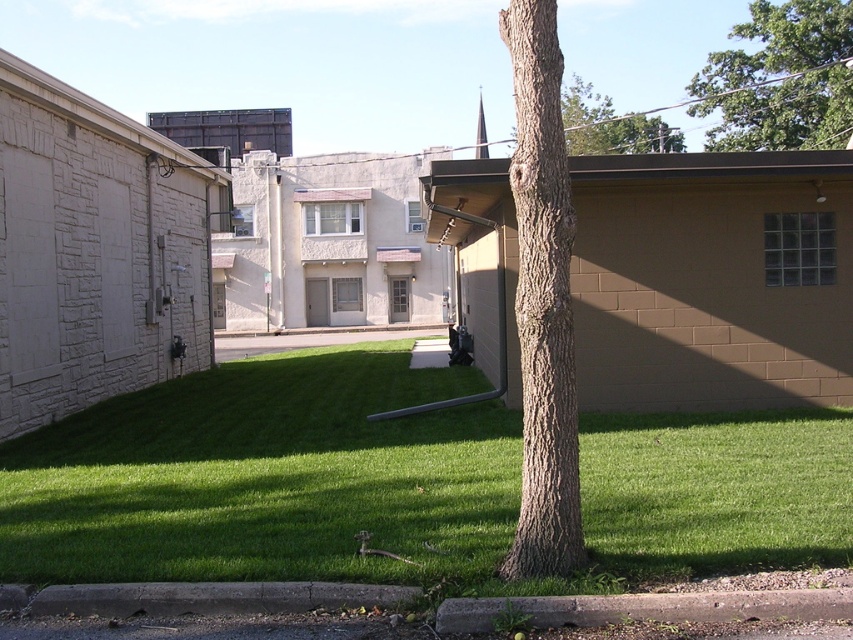
Does green grass at center appear on the right side of brown rough bark tree trunk at center?

No, green grass at center is not to the right of brown rough bark tree trunk at center.

Is point (175, 524) farther from camera compared to point (546, 132)?

Yes, it is behind point (546, 132).

This screenshot has width=853, height=640. Identify the location of green grass at center. (270, 480).

Can you confirm if brown rough bark tree trunk at center is bigger than green leafy tree at upper right?

No, brown rough bark tree trunk at center is not bigger than green leafy tree at upper right.

Consider the image. Does brown rough bark tree trunk at center have a greater height compared to green leafy tree at upper right?

In fact, brown rough bark tree trunk at center may be shorter than green leafy tree at upper right.

Is point (544, 234) positioned before point (766, 13)?

Yes, point (544, 234) is closer to viewer.

Locate an element on the screen. Image resolution: width=853 pixels, height=640 pixels. brown rough bark tree trunk at center is located at coordinates (543, 301).

Can you confirm if green grass at center is thinner than green leafy tree at upper right?

Indeed, green grass at center has a lesser width compared to green leafy tree at upper right.

Which is below, green grass at center or green leafy tree at upper right?

Positioned lower is green grass at center.

Is point (599, 550) farther from viewer compared to point (778, 22)?

No, (599, 550) is in front of (778, 22).

Image resolution: width=853 pixels, height=640 pixels. What are the coordinates of `green grass at center` in the screenshot? It's located at (270, 480).